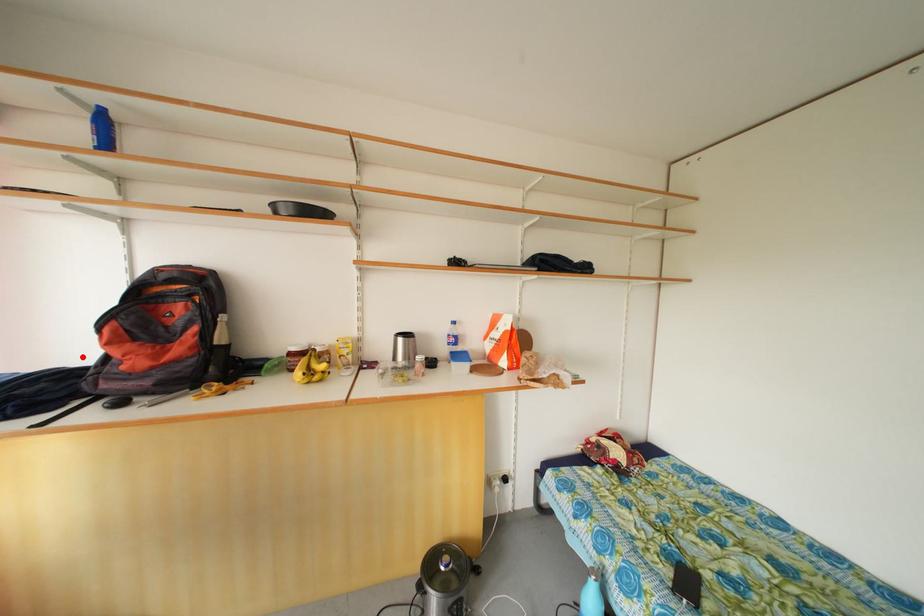
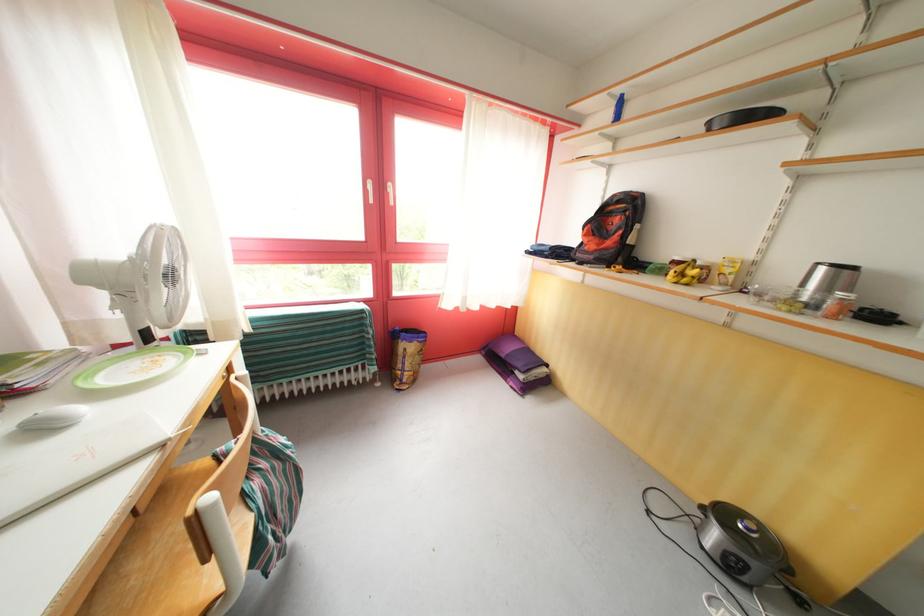
Question: I am providing you with two images of the same scene from different viewpoints. A red point is marked on the first image. Can you still see the location of the red point in image 2?

Choices:
 (A) Yes
 (B) No

Answer: (A)